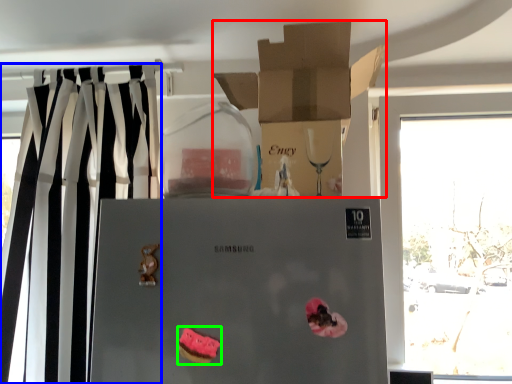
Question: Which is nearer to the box (highlighted by a red box)? curtain (highlighted by a blue box) or stuff (highlighted by a green box).

Choices:
 (A) curtain
 (B) stuff

Answer: (A)